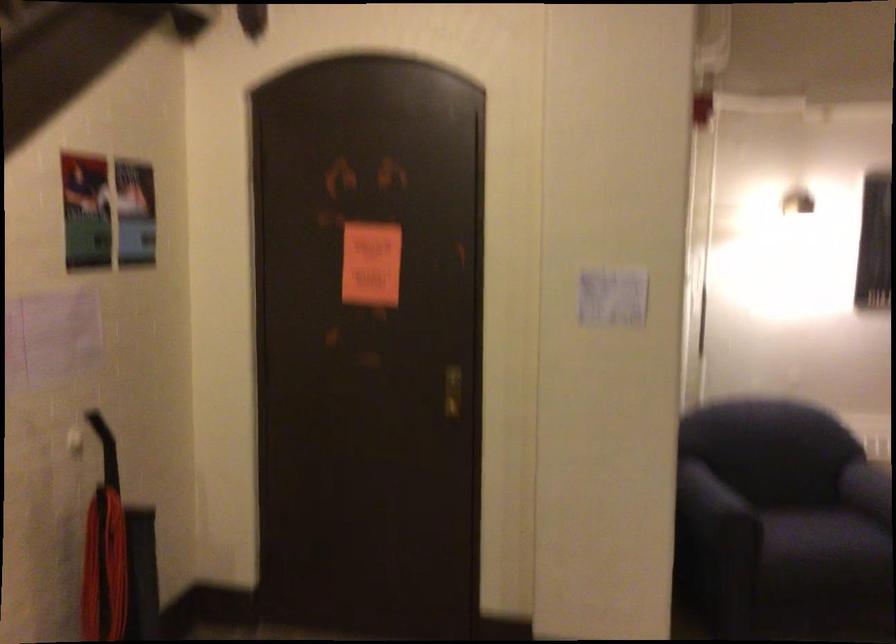
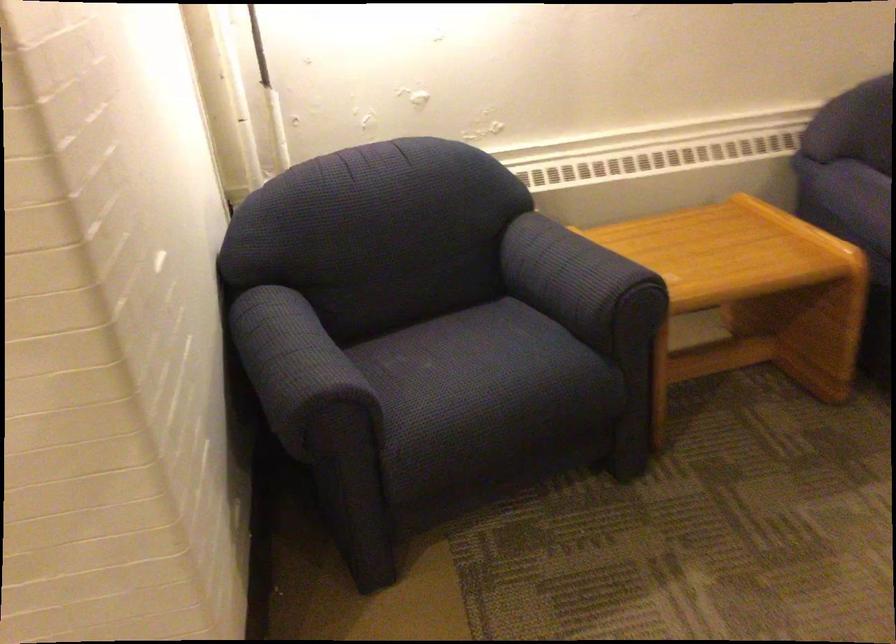
Where in the second image is the point corresponding to [686,491] from the first image?

(294, 363)